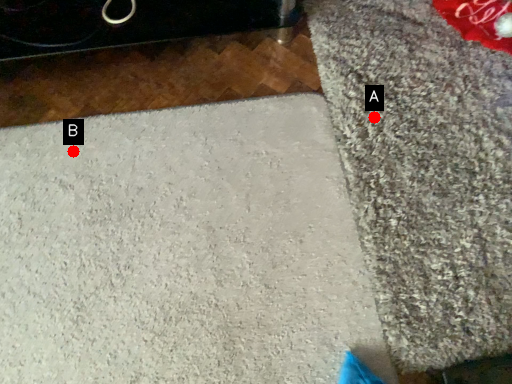
Question: Two points are circled on the image, labeled by A and B beside each circle. Which point is closer to the camera?

Choices:
 (A) A is closer
 (B) B is closer

Answer: (B)